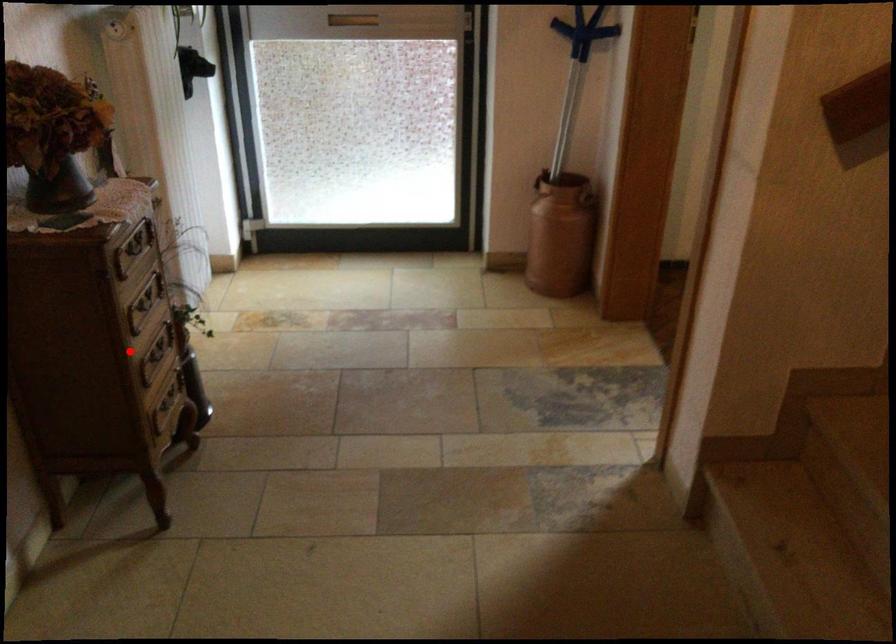
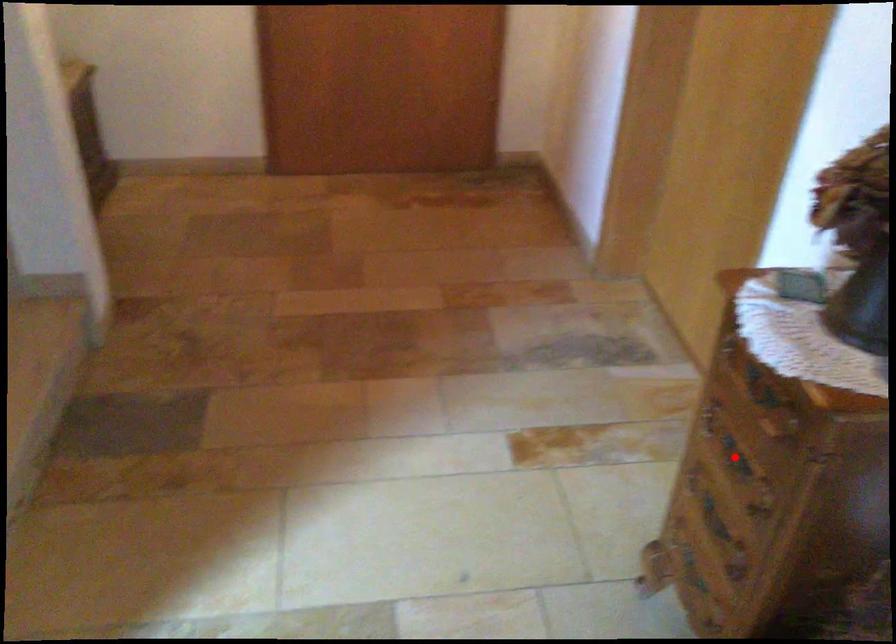
I am providing you with two images of the same scene from different viewpoints. A red point is marked on the first image and another point is marked on the second image. Is the red point in image1 aligned with the point shown in image2?

Yes